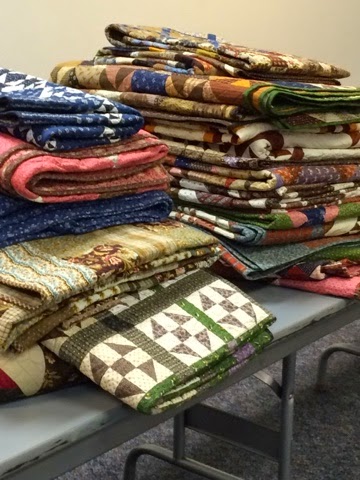
You are a GUI agent. You are given a task and a screenshot of the screen. Output one action in this format:
    pyautogui.click(x=<x>, y=<y>)
    Task: Click on the blue and white blanket on left side of image
    This screenshot has height=480, width=360.
    Given the screenshot: What is the action you would take?
    pyautogui.click(x=30, y=92)